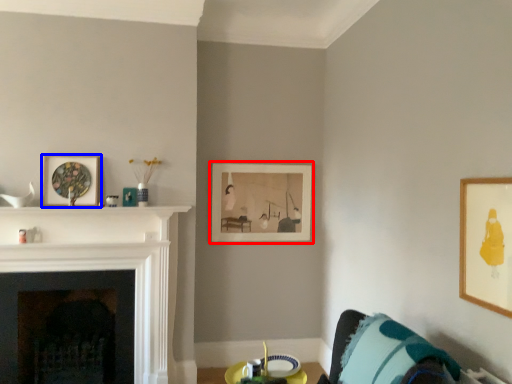
Question: Which of the following is the closest to the observer, picture frame (highlighted by a red box) or picture frame (highlighted by a blue box)?

Choices:
 (A) picture frame
 (B) picture frame

Answer: (B)